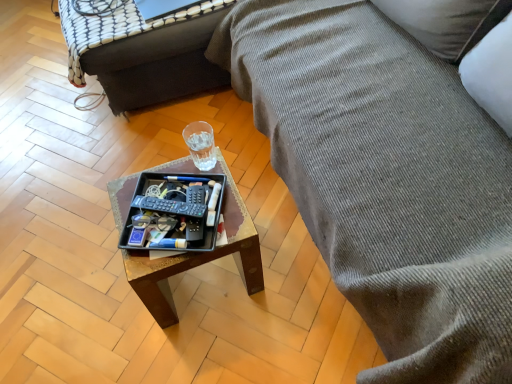
Question: From the image's perspective, is wooden tray at center beneath clear glass cup at center?

Choices:
 (A) no
 (B) yes

Answer: (A)

Question: From a real-world perspective, is wooden tray at center physically above clear glass cup at center?

Choices:
 (A) yes
 (B) no

Answer: (B)

Question: Does wooden tray at center have a greater width compared to clear glass cup at center?

Choices:
 (A) yes
 (B) no

Answer: (A)

Question: Can you confirm if wooden tray at center is bigger than clear glass cup at center?

Choices:
 (A) no
 (B) yes

Answer: (B)

Question: Is wooden tray at center located outside clear glass cup at center?

Choices:
 (A) yes
 (B) no

Answer: (A)

Question: In terms of height, does textured gray fabric couch at right look taller or shorter compared to black plastic tray at center?

Choices:
 (A) tall
 (B) short

Answer: (A)

Question: From the image's perspective, is textured gray fabric couch at right above or below black plastic tray at center?

Choices:
 (A) below
 (B) above

Answer: (B)

Question: Is point (343, 34) closer or farther from the camera than point (187, 205)?

Choices:
 (A) farther
 (B) closer

Answer: (A)

Question: Considering the positions of textured gray fabric couch at right and black plastic tray at center in the image, is textured gray fabric couch at right bigger or smaller than black plastic tray at center?

Choices:
 (A) big
 (B) small

Answer: (A)

Question: Is wooden tray at center situated inside wooden tray at center or outside?

Choices:
 (A) inside
 (B) outside

Answer: (B)

Question: From a real-world perspective, relative to wooden tray at center, is wooden tray at center vertically above or below?

Choices:
 (A) below
 (B) above

Answer: (A)

Question: In the image, is wooden tray at center on the left side or the right side of wooden tray at center?

Choices:
 (A) left
 (B) right

Answer: (B)

Question: Relative to wooden tray at center, is wooden tray at center in front or behind?

Choices:
 (A) front
 (B) behind

Answer: (A)

Question: Looking at their shapes, would you say clear glass cup at center is wider or thinner than textured gray fabric couch at right?

Choices:
 (A) wide
 (B) thin

Answer: (B)

Question: Considering the relative positions of clear glass cup at center and textured gray fabric couch at right in the image provided, is clear glass cup at center to the left or to the right of textured gray fabric couch at right?

Choices:
 (A) left
 (B) right

Answer: (A)